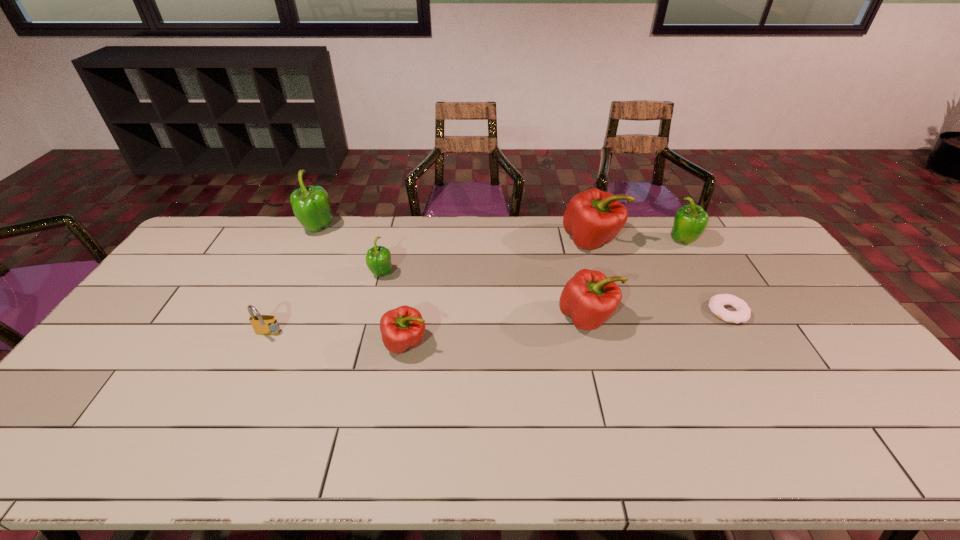
You are a GUI agent. You are given a task and a screenshot of the screen. Output one action in this format:
    pyautogui.click(x=<x>, y=<y>)
    Task: Click on the padlock
    The width and height of the screenshot is (960, 540).
    Given the screenshot: What is the action you would take?
    pyautogui.click(x=262, y=324)

Where is `doughnut`? The image size is (960, 540). doughnut is located at coordinates (716, 304).

This screenshot has width=960, height=540. I want to click on blank area located 0.320m on the left of the leftmost bell pepper, so click(x=215, y=230).

The image size is (960, 540). In order to click on vacant space located 0.160m on the right of the biggest pink bell pepper in this screenshot , I will do click(666, 241).

You are a GUI agent. You are given a task and a screenshot of the screen. Output one action in this format:
    pyautogui.click(x=<x>, y=<y>)
    Task: Click on the free spot located on the front of the second smallest green bell pepper
    Image resolution: width=960 pixels, height=540 pixels.
    Given the screenshot: What is the action you would take?
    pyautogui.click(x=712, y=293)

This screenshot has width=960, height=540. In order to click on free space located 0.240m on the right of the second smallest pink bell pepper in this screenshot , I will do `click(699, 318)`.

The image size is (960, 540). Find the location of `vacant region located on the front of the third nearest bell pepper`. vacant region located on the front of the third nearest bell pepper is located at coordinates (372, 313).

This screenshot has width=960, height=540. I want to click on vacant space located on the back of the fourth bell pepper from right to left, so click(x=421, y=248).

Where is `free location located 0.320m on the side with the combination dials of the padlock`? The height and width of the screenshot is (540, 960). free location located 0.320m on the side with the combination dials of the padlock is located at coordinates (213, 448).

Locate an element on the screen. The image size is (960, 540). free space located 0.350m on the back of the shortest object is located at coordinates (682, 233).